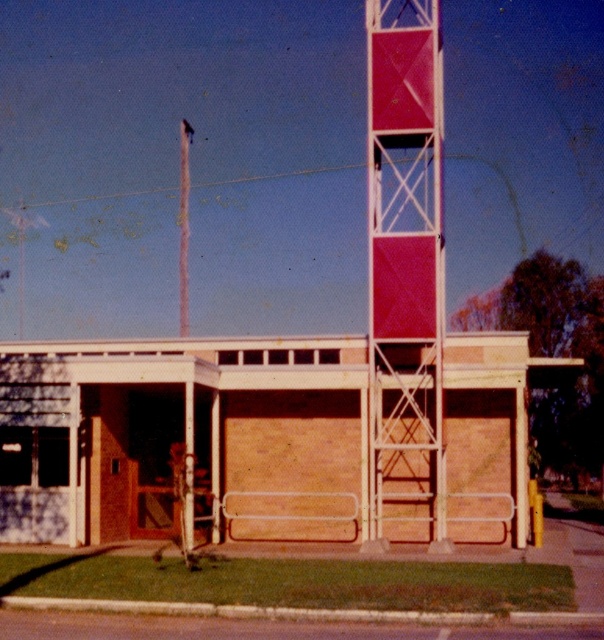
Can you confirm if wooden boarded-up garage at center is taller than metallic red bell tower at center?

In fact, wooden boarded-up garage at center may be shorter than metallic red bell tower at center.

Does wooden boarded-up garage at center come behind metallic red bell tower at center?

No.

Identify the location of wooden boarded-up garage at center. The width and height of the screenshot is (604, 640). (262, 438).

I want to click on wooden boarded-up garage at center, so click(x=262, y=438).